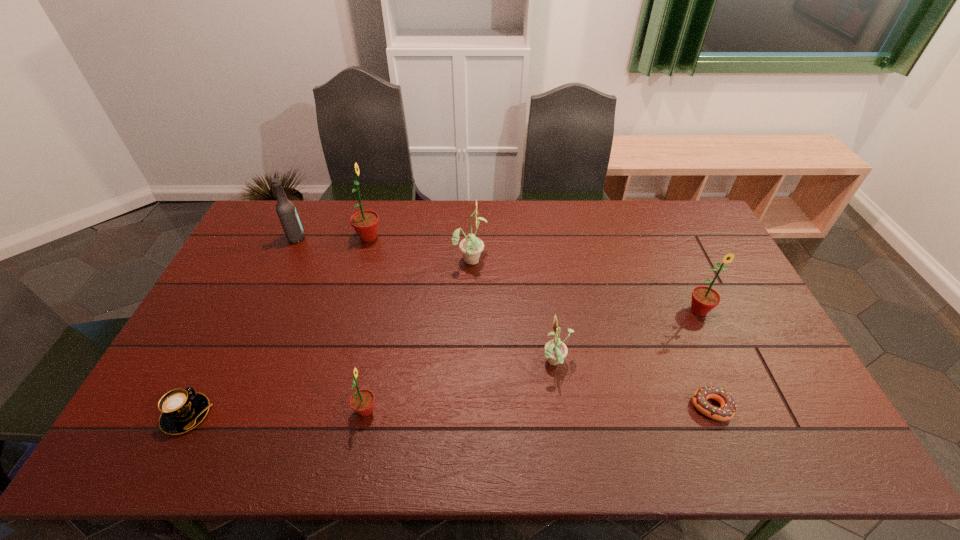
Image resolution: width=960 pixels, height=540 pixels. Identify the location of the farthest green sunflower. (365, 222).

Identify the location of the biggest green sunflower. Image resolution: width=960 pixels, height=540 pixels. (365, 222).

The height and width of the screenshot is (540, 960). I want to click on beer bottle, so click(x=286, y=211).

Locate an element on the screen. This screenshot has width=960, height=540. the sixth nearest object is located at coordinates (471, 247).

Locate an element on the screen. Image resolution: width=960 pixels, height=540 pixels. the bigger yellow sunflower is located at coordinates (471, 247).

This screenshot has height=540, width=960. I want to click on the rightmost green sunflower, so click(704, 299).

This screenshot has width=960, height=540. I want to click on the second biggest green sunflower, so click(x=704, y=299).

This screenshot has height=540, width=960. Find the location of `the second nearest sunflower`. the second nearest sunflower is located at coordinates (555, 350).

Locate an element on the screen. The height and width of the screenshot is (540, 960). the right yellow sunflower is located at coordinates (555, 350).

Locate an element on the screen. The width and height of the screenshot is (960, 540). the smallest green sunflower is located at coordinates (362, 401).